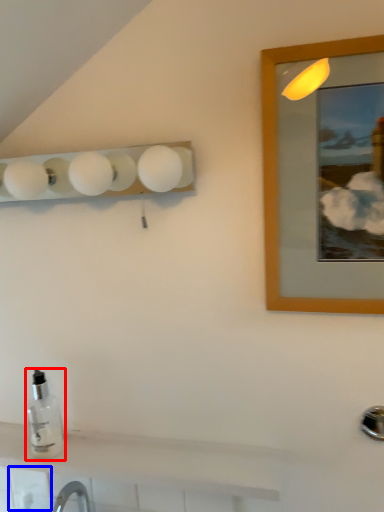
Question: Which object appears farthest to the camera in this image, bottle (highlighted by a red box) or tile (highlighted by a blue box)?

Choices:
 (A) bottle
 (B) tile

Answer: (B)